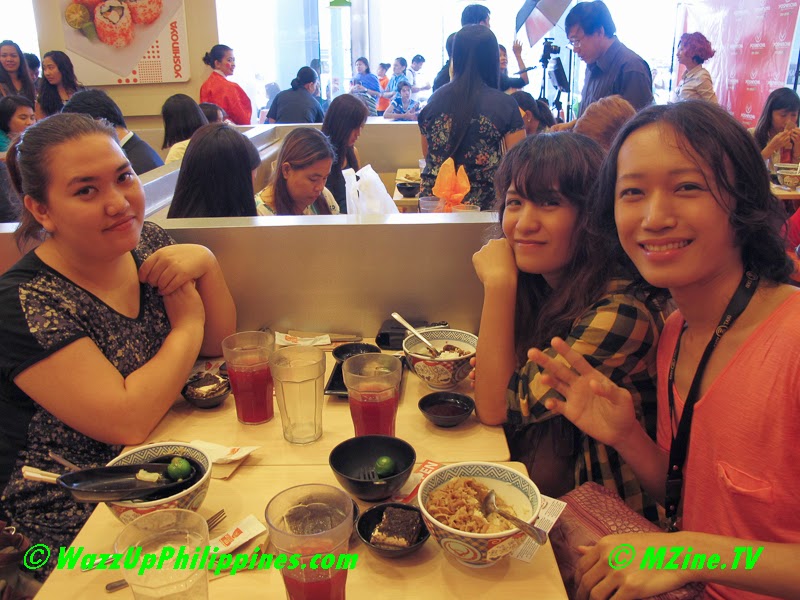
Identify the location of bowls. (198, 480), (368, 476), (498, 544), (457, 414), (450, 361), (350, 344), (412, 189), (782, 175), (782, 164), (214, 393).